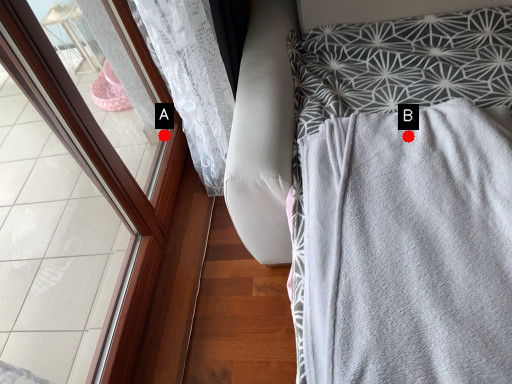
Question: Two points are circled on the image, labeled by A and B beside each circle. Which point is closer to the camera?

Choices:
 (A) A is closer
 (B) B is closer

Answer: (B)